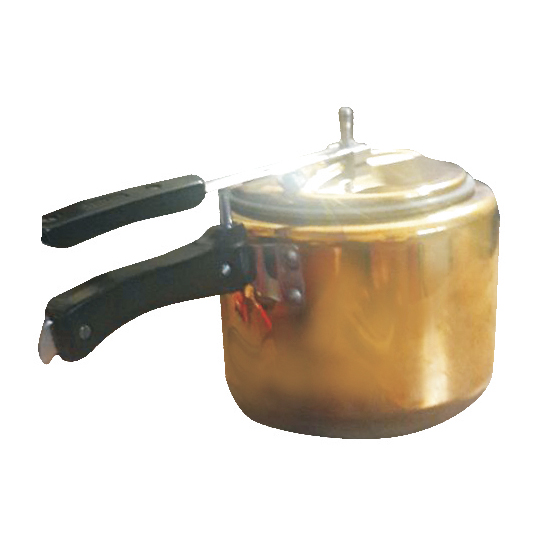
Image resolution: width=540 pixels, height=540 pixels. Identify the location of knob. (349, 106).